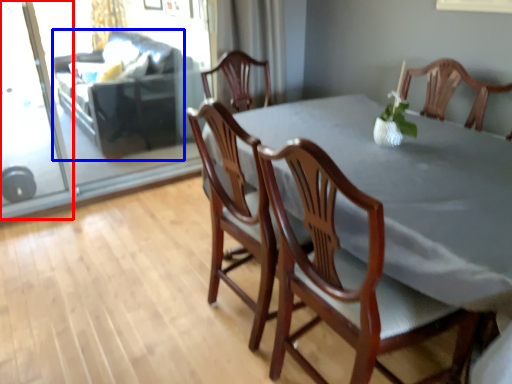
Question: Which object is closer to the camera taking this photo, screen door (highlighted by a red box) or couch (highlighted by a blue box)?

Choices:
 (A) screen door
 (B) couch

Answer: (A)